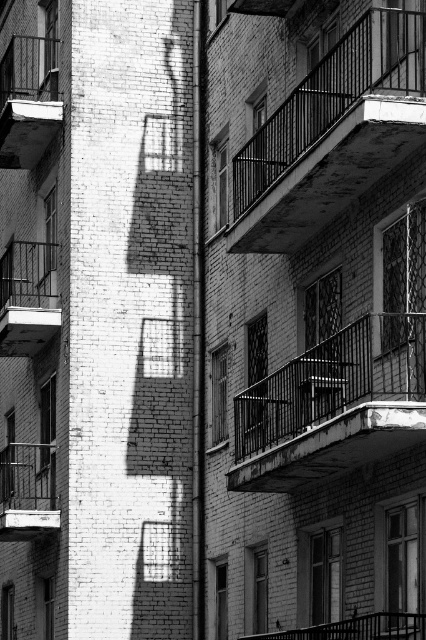
Does rusty metal balcony at upper right appear under metallic balcony at left?

Yes.

Which is more to the left, rusty metal balcony at upper right or metallic balcony at left?

Positioned to the left is metallic balcony at left.

Is point (344, 51) positioned after point (48, 76)?

No, it is not.

Image resolution: width=426 pixels, height=640 pixels. In order to click on rusty metal balcony at upper right in this screenshot , I will do `click(333, 134)`.

Does point (362, 461) lie behind point (45, 500)?

No, (362, 461) is in front of (45, 500).

From the picture: Between rusty metal balcony at center and metallic balcony at lower left, which one appears on the left side from the viewer's perspective?

From the viewer's perspective, metallic balcony at lower left appears more on the left side.

Describe the element at coordinates (333, 404) in the screenshot. I see `rusty metal balcony at center` at that location.

You are a GUI agent. You are given a task and a screenshot of the screen. Output one action in this format:
    pyautogui.click(x=<x>, y=<y>)
    Task: Click on the rusty metal balcony at center
    
    Given the screenshot: What is the action you would take?
    pyautogui.click(x=333, y=404)

Does black metal balcony at left have a lesser width compared to metallic balcony at lower left?

Correct, black metal balcony at left's width is less than metallic balcony at lower left's.

Does black metal balcony at left appear on the right side of metallic balcony at lower left?

No, black metal balcony at left is not to the right of metallic balcony at lower left.

Which is behind, point (14, 349) or point (40, 477)?

Positioned behind is point (14, 349).

Find the location of a particular element. black metal balcony at left is located at coordinates (28, 298).